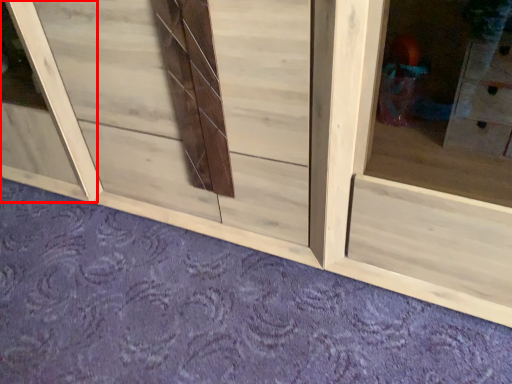
Question: Where is window frame (annotated by the red box) located in relation to plain in the image?

Choices:
 (A) left
 (B) right

Answer: (A)